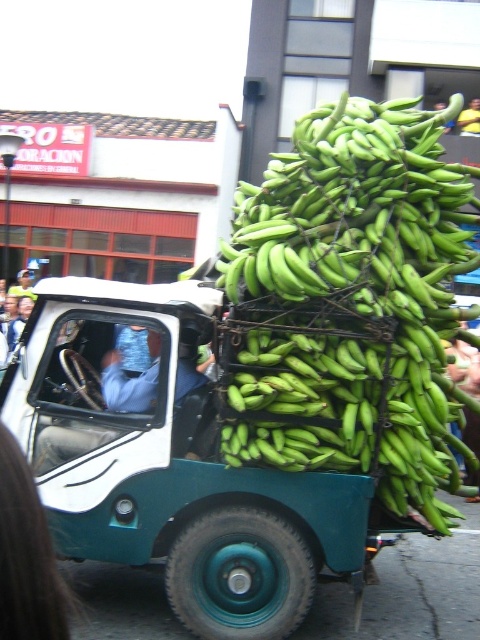
Does point (272, 502) come in front of point (112, 403)?

Yes, point (272, 502) is in front of point (112, 403).

Is green rubber truck at center thinner than blue fabric shirt at left?

Incorrect, green rubber truck at center's width is not less than blue fabric shirt at left's.

Is point (212, 525) positioned in front of point (119, 352)?

Yes, point (212, 525) is closer to viewer.

Where is `green rubber truck at center`? The height and width of the screenshot is (640, 480). green rubber truck at center is located at coordinates pos(177,461).

Is green matte bananas at center in front of blue fabric shirt at left?

Yes, green matte bananas at center is closer to the viewer.

Which is behind, point (372, 298) or point (146, 394)?

Positioned behind is point (146, 394).

In order to click on green matte bananas at center in this screenshot , I will do `click(355, 298)`.

Is point (183, 346) closer to viewer compared to point (420, 456)?

That is False.

Does green rubber truck at center have a lesser height compared to green matte bananas at center?

Indeed, green rubber truck at center has a lesser height compared to green matte bananas at center.

Describe the element at coordinates (177, 461) in the screenshot. I see `green rubber truck at center` at that location.

Where is `green rubber truck at center`? The height and width of the screenshot is (640, 480). green rubber truck at center is located at coordinates (177, 461).